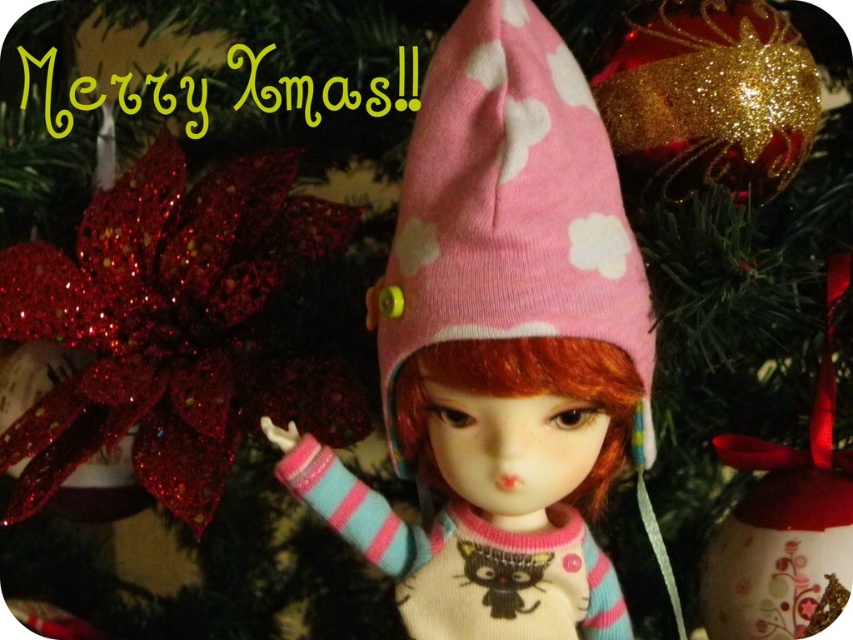
Question: Which point appears farthest from the camera in this image?

Choices:
 (A) (457, 314)
 (B) (265, 272)

Answer: (B)

Question: Among these points, which one is farthest from the camera?

Choices:
 (A) (503, 273)
 (B) (239, 304)

Answer: (B)

Question: Which point is closer to the camera?

Choices:
 (A) (225, 163)
 (B) (415, 152)

Answer: (B)

Question: Does sparkly red flower at left appear over pink knitted hat at center?

Choices:
 (A) yes
 (B) no

Answer: (B)

Question: Is sparkly red flower at left to the left of pink knitted hat at center from the viewer's perspective?

Choices:
 (A) yes
 (B) no

Answer: (A)

Question: Can you confirm if sparkly red flower at left is thinner than pink knitted hat at center?

Choices:
 (A) yes
 (B) no

Answer: (B)